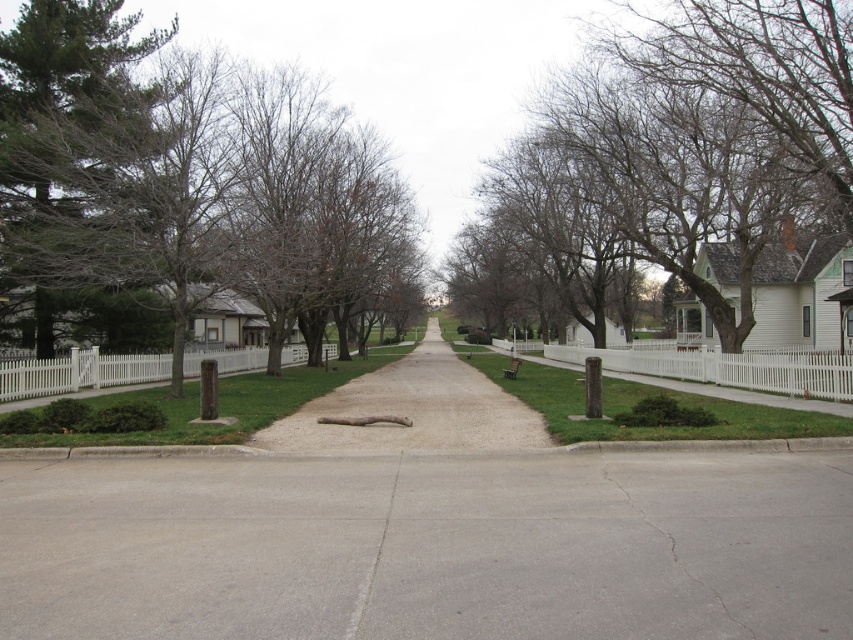
Question: Can you confirm if gray concrete pavement at center is positioned above gravel driveway at center?

Choices:
 (A) no
 (B) yes

Answer: (B)

Question: Can you confirm if gravel driveway at center is bigger than gray concrete crack at center?

Choices:
 (A) yes
 (B) no

Answer: (A)

Question: Estimate the real-world distances between objects in this image. Which object is farther from the gray concrete pavement at center?

Choices:
 (A) green leafy tree at left
 (B) gravel driveway at center
 (C) gray concrete crack at center
 (D) bare branches at upper center

Answer: (A)

Question: Which point appears closest to the camera in this image?

Choices:
 (A) (717, 541)
 (B) (358, 621)
 (C) (155, 257)

Answer: (B)

Question: Does green leafy tree at left have a greater width compared to gravel driveway at center?

Choices:
 (A) no
 (B) yes

Answer: (B)

Question: Considering the real-world distances, which object is farthest from the gray concrete crack at center?

Choices:
 (A) gray concrete pavement at center
 (B) green leafy tree at left
 (C) gravel driveway at center
 (D) bare branches at upper center

Answer: (B)